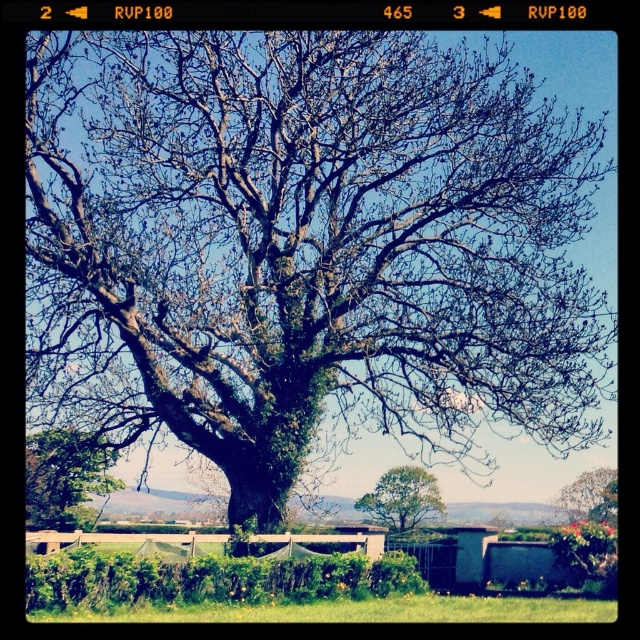
You are a gardener planning to install a new sprinkler system in the garden. The sprinkler requires a space that is wider than the green leafy tree at center. Can the area near the green mossy oak at center accommodate the sprinkler?

The green mossy oak at center has a greater width than the green leafy tree at center. Since the sprinkler requires a space wider than the green leafy tree at center, the area near the green mossy oak at center can accommodate the sprinkler because its width is sufficient.

You are standing in the garden and want to walk from the wooden fence to the green mossy oak at center. Which direction should you walk to avoid the green leafy tree at lower left?

You should walk to the right side of the green leafy tree at lower left because the green mossy oak at center is positioned on the right side of it.